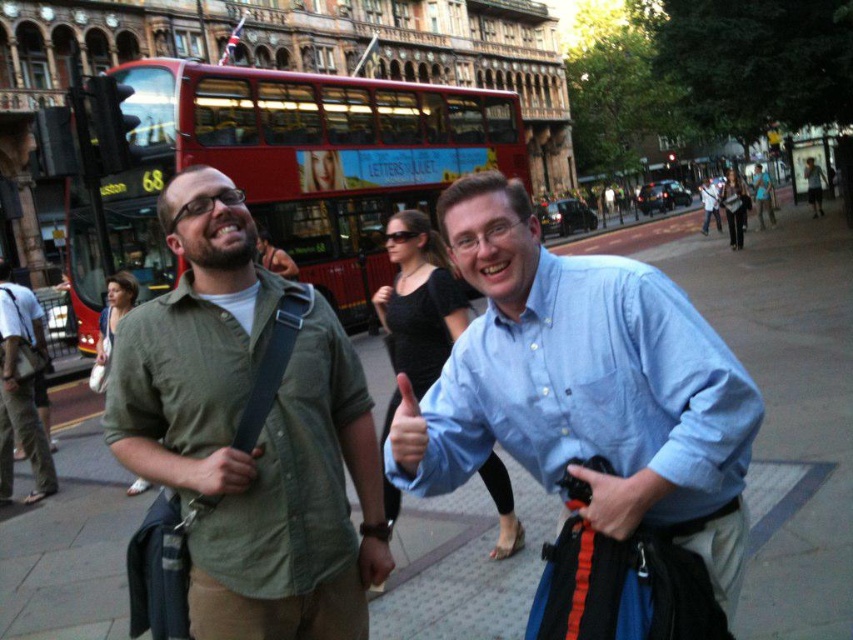
Is green cotton shirt at center to the left of light blue shirt at center from the viewer's perspective?

Correct, you'll find green cotton shirt at center to the left of light blue shirt at center.

Can you confirm if green cotton shirt at center is smaller than light blue shirt at center?

Yes, green cotton shirt at center is smaller than light blue shirt at center.

Locate an element on the screen. green cotton shirt at center is located at coordinates (252, 433).

Between red double-decker bus at center and smooth skin hand at center, which one has more height?

red double-decker bus at center is taller.

Does red double-decker bus at center have a lesser height compared to smooth skin hand at center?

No, red double-decker bus at center is not shorter than smooth skin hand at center.

Describe the element at coordinates (300, 161) in the screenshot. The image size is (853, 640). I see `red double-decker bus at center` at that location.

I want to click on red double-decker bus at center, so click(x=300, y=161).

Does smooth concrete sidewalk at center appear on the left side of matte black strap at center?

In fact, smooth concrete sidewalk at center is to the right of matte black strap at center.

Is point (810, 374) positioned behind point (254, 452)?

Yes, it is behind point (254, 452).

At what (x,y) coordinates should I click in order to perform the action: click on smooth concrete sidewalk at center. Please return your answer as a coordinate pair (x, y). Looking at the image, I should click on (782, 403).